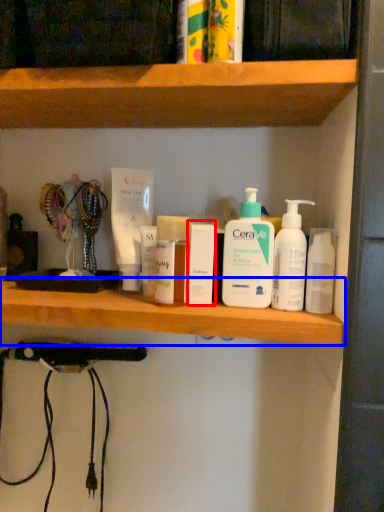
Question: Among these objects, which one is farthest to the camera, toiletry (highlighted by a red box) or shelf (highlighted by a blue box)?

Choices:
 (A) toiletry
 (B) shelf

Answer: (A)